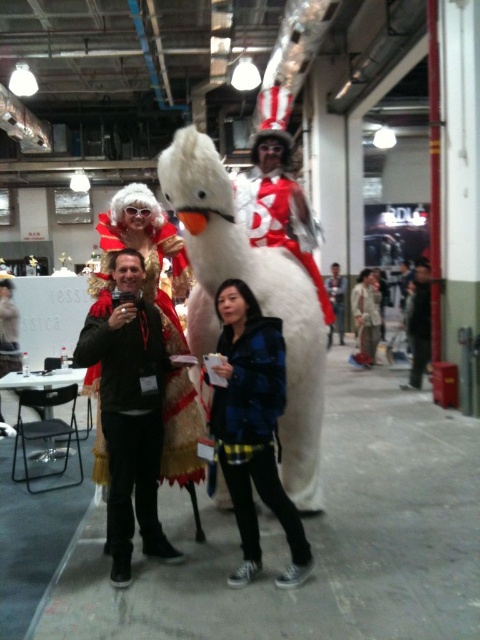
Is point (257, 177) more distant than point (399, 385)?

No, (257, 177) is in front of (399, 385).

I want to click on white plush horse at center, so [x=278, y=220].

Is point (291, 195) less distant than point (411, 330)?

Yes, point (291, 195) is closer to viewer.

Find the location of a particular element. The width and height of the screenshot is (480, 640). white plush horse at center is located at coordinates (278, 220).

How much distance is there between black matte jacket at center and fuzzy white costume at center?

black matte jacket at center is 3.28 feet away from fuzzy white costume at center.

Is black matte jacket at center closer to camera compared to fuzzy white costume at center?

Yes, black matte jacket at center is in front of fuzzy white costume at center.

The width and height of the screenshot is (480, 640). In order to click on black matte jacket at center in this screenshot , I will do coord(419,324).

Does point (148, 552) come farther from viewer compared to point (332, 326)?

No.

Does dark brown leather jacket at center have a larger size compared to matte gold helmet at center?

Incorrect, dark brown leather jacket at center is not larger than matte gold helmet at center.

Between point (122, 413) and point (334, 289), which one is positioned in front?

Point (122, 413)

Locate an element on the screen. The height and width of the screenshot is (640, 480). dark brown leather jacket at center is located at coordinates (130, 412).